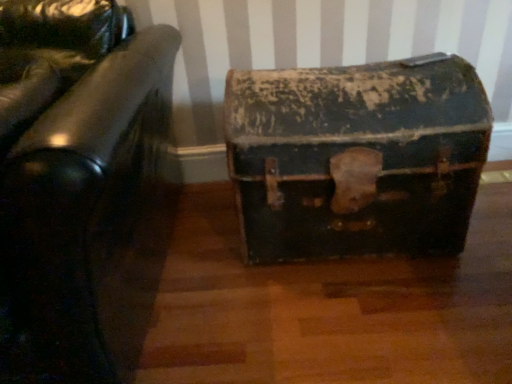
Question: From the image's perspective, is rusty metal trunk at center on top of rusty metal trunk at center?

Choices:
 (A) no
 (B) yes

Answer: (A)

Question: Is rusty metal trunk at center positioned in front of rusty metal trunk at center?

Choices:
 (A) yes
 (B) no

Answer: (A)

Question: Is rusty metal trunk at center positioned behind rusty metal trunk at center?

Choices:
 (A) no
 (B) yes

Answer: (A)

Question: Considering the relative sizes of rusty metal trunk at center and rusty metal trunk at center in the image provided, is rusty metal trunk at center bigger than rusty metal trunk at center?

Choices:
 (A) yes
 (B) no

Answer: (A)

Question: Can you confirm if rusty metal trunk at center is shorter than rusty metal trunk at center?

Choices:
 (A) yes
 (B) no

Answer: (B)

Question: Considering the relative sizes of rusty metal trunk at center and rusty metal trunk at center in the image provided, is rusty metal trunk at center taller than rusty metal trunk at center?

Choices:
 (A) yes
 (B) no

Answer: (A)

Question: From a real-world perspective, is rusty metal trunk at center positioned over rusty metal trunk at center based on gravity?

Choices:
 (A) yes
 (B) no

Answer: (B)

Question: Can you confirm if rusty metal trunk at center is smaller than rusty metal trunk at center?

Choices:
 (A) yes
 (B) no

Answer: (A)

Question: Does rusty metal trunk at center have a greater width compared to rusty metal trunk at center?

Choices:
 (A) yes
 (B) no

Answer: (B)

Question: Can you confirm if rusty metal trunk at center is positioned to the left of rusty metal trunk at center?

Choices:
 (A) no
 (B) yes

Answer: (A)

Question: Does rusty metal trunk at center come in front of rusty metal trunk at center?

Choices:
 (A) yes
 (B) no

Answer: (B)

Question: Would you say rusty metal trunk at center is outside rusty metal trunk at center?

Choices:
 (A) no
 (B) yes

Answer: (B)

Question: Based on their sizes in the image, would you say rusty metal trunk at center is bigger or smaller than rusty metal trunk at center?

Choices:
 (A) small
 (B) big

Answer: (A)